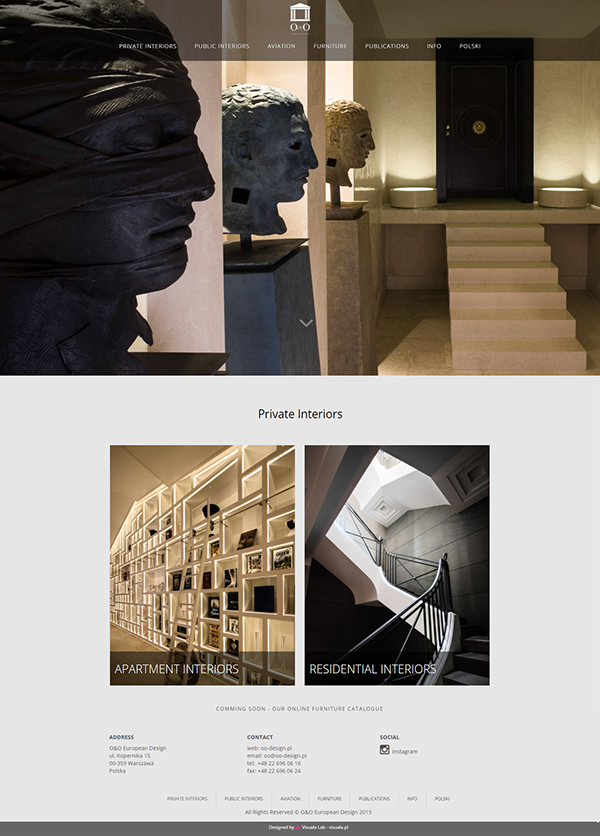
This screenshot has width=600, height=836. Identify the location of off white colored statue of a head. (350, 144).